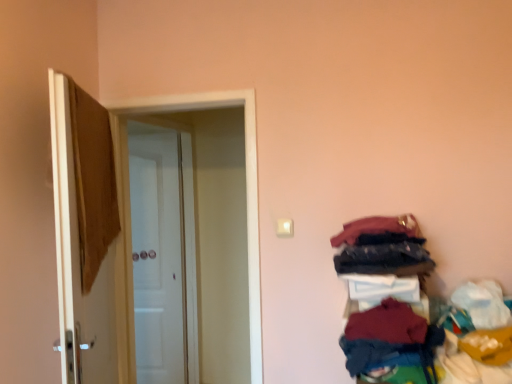
Question: Is white glossy door at center, which is counted as the second door, starting from the back, taller or shorter than brown fabric at left, the third door from the back?

Choices:
 (A) tall
 (B) short

Answer: (A)

Question: From a real-world perspective, is white glossy door at center, which is counted as the second door, starting from the back, physically located above or below brown fabric at left, the first door positioned from the front?

Choices:
 (A) below
 (B) above

Answer: (A)

Question: Considering the real-world distances, which object is farthest from the maroon fabric shirt at lower right, marked as the 1th clothing in a bottom-to-top arrangement?

Choices:
 (A) velvet-like red fabric at upper right, which is the 4th clothing in bottom-to-top order
 (B) dark red fabric at lower right, marked as the 3th clothing in a top-to-bottom arrangement
 (C) brown fabric at left, the third door from the back
 (D) dark blue fabric at right, the 3th clothing when ordered from bottom to top
 (E) white glossy door at center, the 3th door positioned from the front

Answer: (E)

Question: Which of these objects is positioned farthest from the dark red fabric at lower right, acting as the second clothing starting from the bottom?

Choices:
 (A) dark blue fabric at right, the second clothing when ordered from top to bottom
 (B) white glossy door at center, which is the first door from back to front
 (C) brown fabric at left, the first door positioned from the front
 (D) maroon fabric shirt at lower right, marked as the 1th clothing in a bottom-to-top arrangement
 (E) velvet-like red fabric at upper right, marked as the 1th clothing in a top-to-bottom arrangement

Answer: (B)